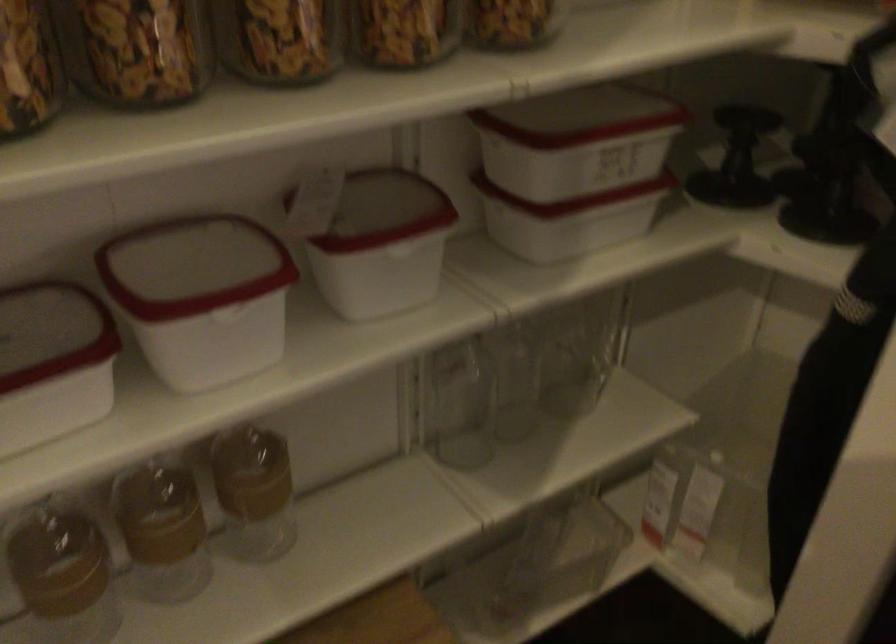
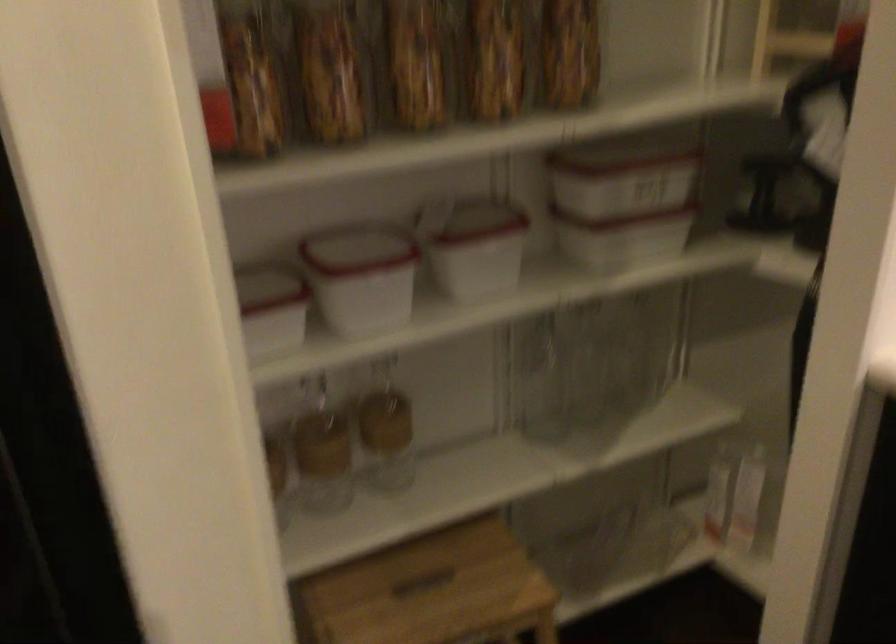
In the second image, find the point that corresponds to the point at 457,386 in the first image.

(541, 379)